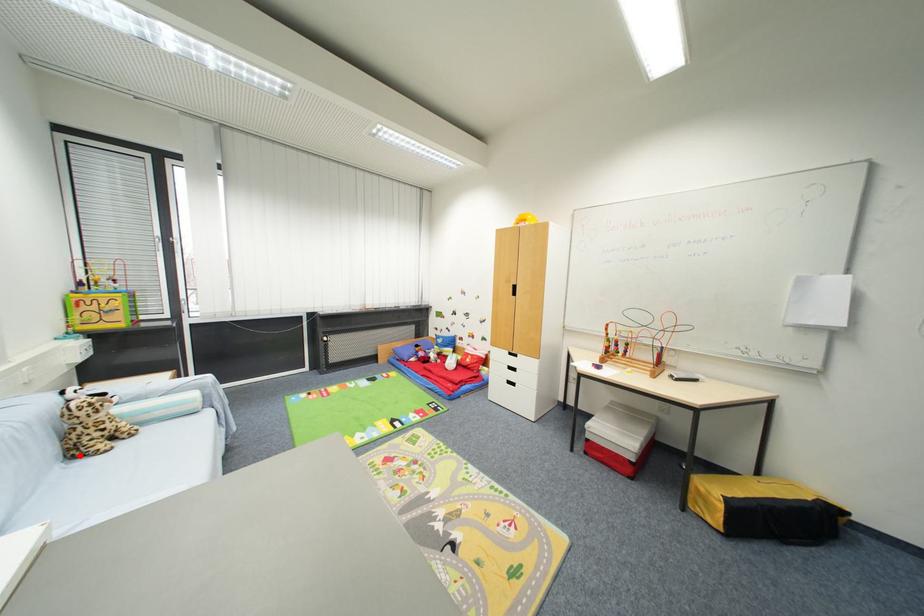
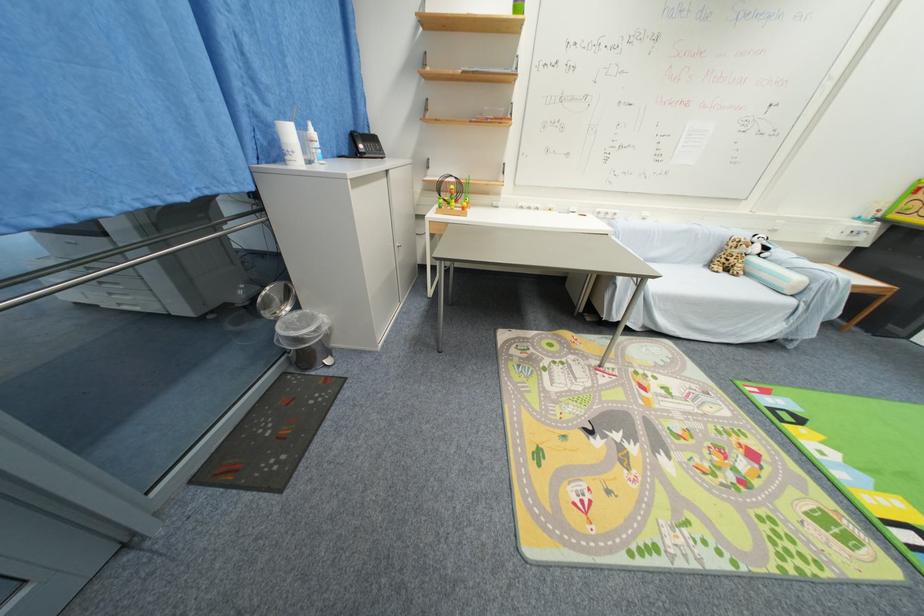
Question: I am providing you with two images of the same scene from different viewpoints. Image1 has a red point marked. In image2, the corresponding 3D location appears at what relative position? Reply with the corresponding letter.

Choices:
 (A) Closer
 (B) Farther

Answer: (A)